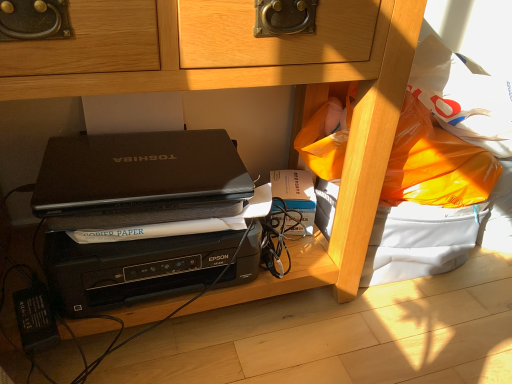
Question: Should I look upward or downward to see matte black laptop at center?

Choices:
 (A) up
 (B) down

Answer: (A)

Question: From the image's perspective, would you say hardcover book at center is shown under black matte laptop at center?

Choices:
 (A) yes
 (B) no

Answer: (B)

Question: Could you tell me if hardcover book at center is turned towards black matte laptop at center?

Choices:
 (A) yes
 (B) no

Answer: (B)

Question: Is hardcover book at center looking in the opposite direction of black matte laptop at center?

Choices:
 (A) no
 (B) yes

Answer: (A)

Question: Is hardcover book at center closer to the viewer compared to black matte laptop at center?

Choices:
 (A) yes
 (B) no

Answer: (B)

Question: Is hardcover book at center wider than black matte laptop at center?

Choices:
 (A) yes
 (B) no

Answer: (B)

Question: Is black matte laptop at center surrounded by hardcover book at center?

Choices:
 (A) yes
 (B) no

Answer: (B)

Question: Is hardcover book at center closer to camera compared to matte black laptop at center?

Choices:
 (A) no
 (B) yes

Answer: (A)

Question: Is matte black laptop at center located within hardcover book at center?

Choices:
 (A) no
 (B) yes

Answer: (A)

Question: Is the position of hardcover book at center more distant than that of matte black laptop at center?

Choices:
 (A) no
 (B) yes

Answer: (B)

Question: From a real-world perspective, is hardcover book at center physically above matte black laptop at center?

Choices:
 (A) no
 (B) yes

Answer: (A)

Question: From the image's perspective, is hardcover book at center over matte black laptop at center?

Choices:
 (A) yes
 (B) no

Answer: (B)

Question: From the image's perspective, does hardcover book at center appear lower than matte black laptop at center?

Choices:
 (A) yes
 (B) no

Answer: (A)

Question: From the image's perspective, is matte black laptop at center on black matte laptop at center?

Choices:
 (A) no
 (B) yes

Answer: (B)